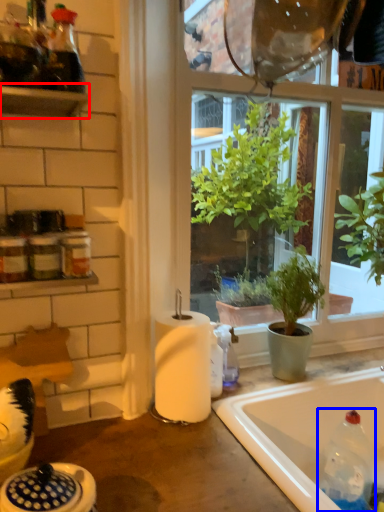
Question: Among these objects, which one is farthest to the camera, shelf (highlighted by a red box) or bottle (highlighted by a blue box)?

Choices:
 (A) shelf
 (B) bottle

Answer: (B)